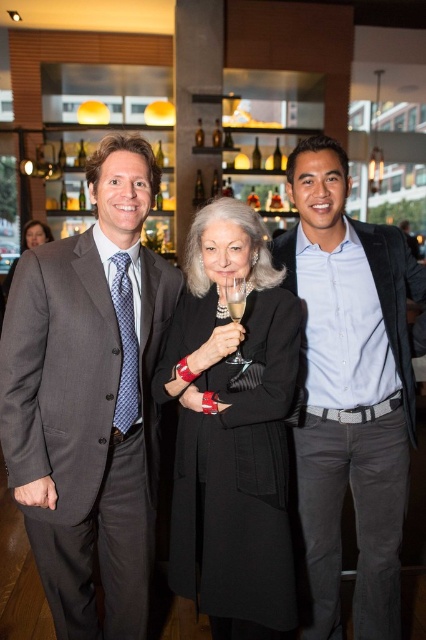
Which is below, black wool coat at center or matte black coat at center?

black wool coat at center is below.

Between point (187, 328) and point (37, 234), which one is positioned in front?

Point (187, 328) is in front.

Who is more forward, [278,618] or [37,237]?

Point [278,618] is in front.

Identify the location of black wool coat at center. (232, 429).

Can you confirm if clear glass wine glass at center is positioned above clear glass wine at center?

No, clear glass wine glass at center is not above clear glass wine at center.

Consider the image. Does clear glass wine glass at center have a greater width compared to clear glass wine at center?

Yes.

Is point (230, 285) behind point (244, 305)?

Yes.

The width and height of the screenshot is (426, 640). What are the coordinates of `clear glass wine glass at center` in the screenshot? It's located at (236, 298).

Does light blue shirt at center have a lesser height compared to black wool coat at center?

Incorrect, light blue shirt at center's height does not fall short of black wool coat at center's.

Who is positioned more to the left, light blue shirt at center or black wool coat at center?

From the viewer's perspective, black wool coat at center appears more on the left side.

Locate an element on the screen. Image resolution: width=426 pixels, height=640 pixels. light blue shirt at center is located at coordinates (351, 388).